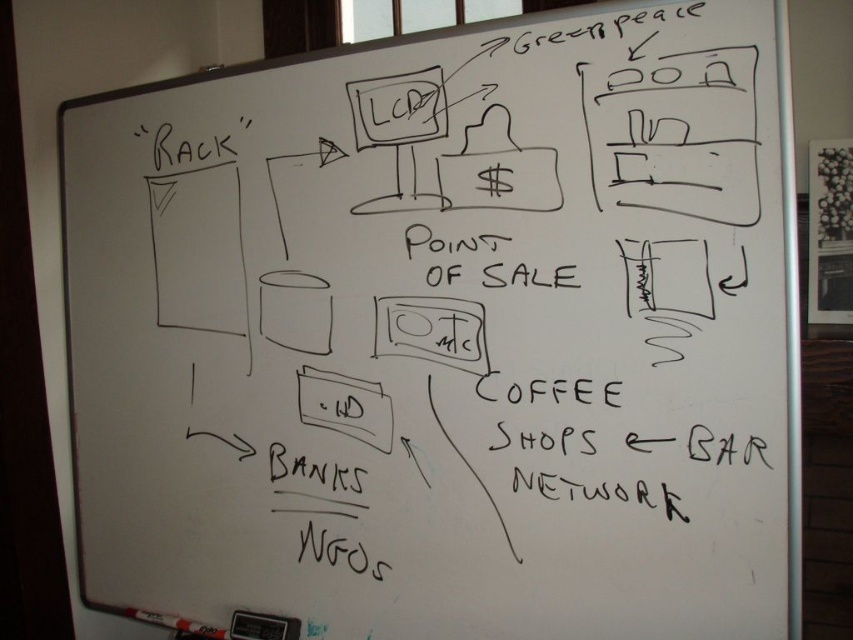
Is white paper at center bigger than white matte marker at bottom left?

Yes.

Between white paper at center and white matte marker at bottom left, which one appears on the right side from the viewer's perspective?

white paper at center

Which is in front, point (349, 378) or point (209, 627)?

Point (349, 378)

What are the coordinates of `white paper at center` in the screenshot? It's located at (345, 406).